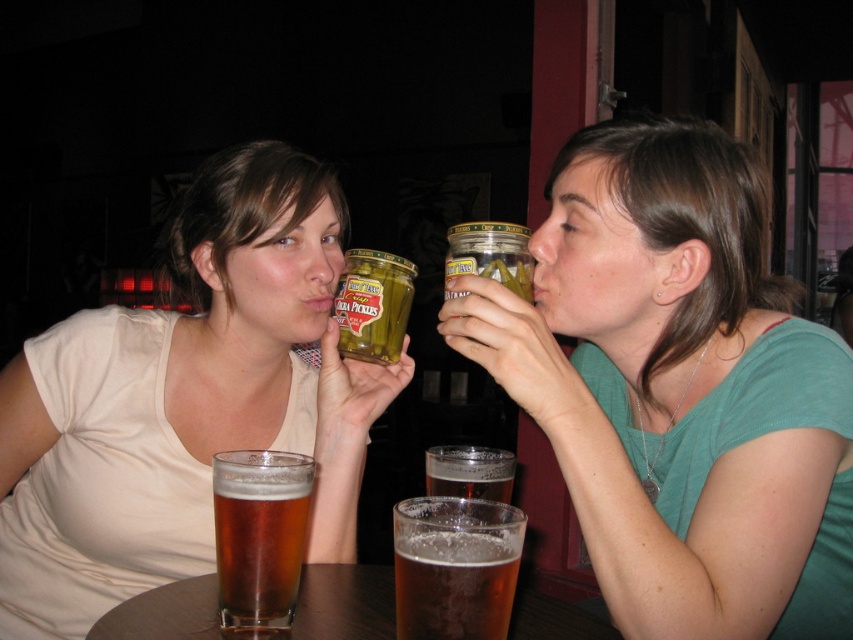
Question: Does translucent glass at lower center have a smaller size compared to brown translucent glass at center?

Choices:
 (A) no
 (B) yes

Answer: (B)

Question: Estimate the real-world distances between objects in this image. Which object is farther from the translucent glass table at center?

Choices:
 (A) brown translucent glass at center
 (B) green glass jar at center

Answer: (B)

Question: Observing the image, what is the correct spatial positioning of translucent glass table at center in reference to brown translucent glass at center?

Choices:
 (A) above
 (B) below

Answer: (B)

Question: Which point is farther from the camera taking this photo?

Choices:
 (A) (387, 589)
 (B) (519, 538)

Answer: (A)

Question: Which point appears farthest from the camera in this image?

Choices:
 (A) (225, 588)
 (B) (294, 296)
 (C) (828, 460)

Answer: (B)

Question: Can you confirm if green matte jar at upper center is positioned below green glass jar at center?

Choices:
 (A) no
 (B) yes

Answer: (B)